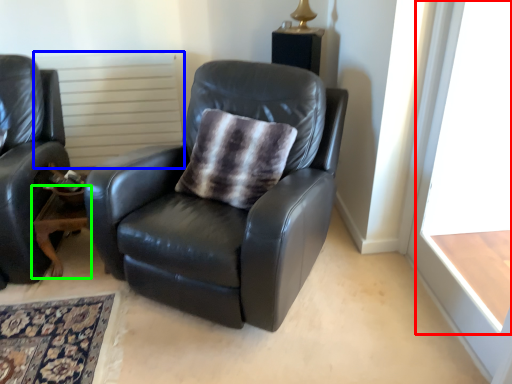
Question: Which object is the closest to the window frame (highlighted by a red box)? Choose among these: radiator (highlighted by a blue box) or table (highlighted by a green box).

Choices:
 (A) radiator
 (B) table

Answer: (B)